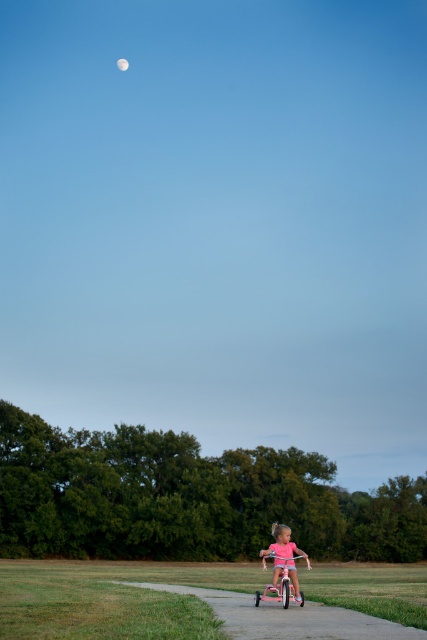
Question: Is pink matte tricycle at center bigger than silvery reflective moon at upper center?

Choices:
 (A) no
 (B) yes

Answer: (B)

Question: Which of these objects is positioned closest to the pink matte tricycle at center?

Choices:
 (A) pink rubber pavement at lower center
 (B) silvery reflective moon at upper center

Answer: (A)

Question: Which point appears farthest from the camera in this image?

Choices:
 (A) (119, 67)
 (B) (373, 621)
 (C) (297, 580)

Answer: (A)

Question: Which point appears closest to the camera in this image?

Choices:
 (A) (298, 612)
 (B) (117, 67)
 (C) (277, 572)

Answer: (A)

Question: Considering the relative positions of pink matte tricycle at center and silvery reflective moon at upper center in the image provided, where is pink matte tricycle at center located with respect to silvery reflective moon at upper center?

Choices:
 (A) right
 (B) left

Answer: (A)

Question: Is pink rubber pavement at lower center to the right of silvery reflective moon at upper center from the viewer's perspective?

Choices:
 (A) yes
 (B) no

Answer: (A)